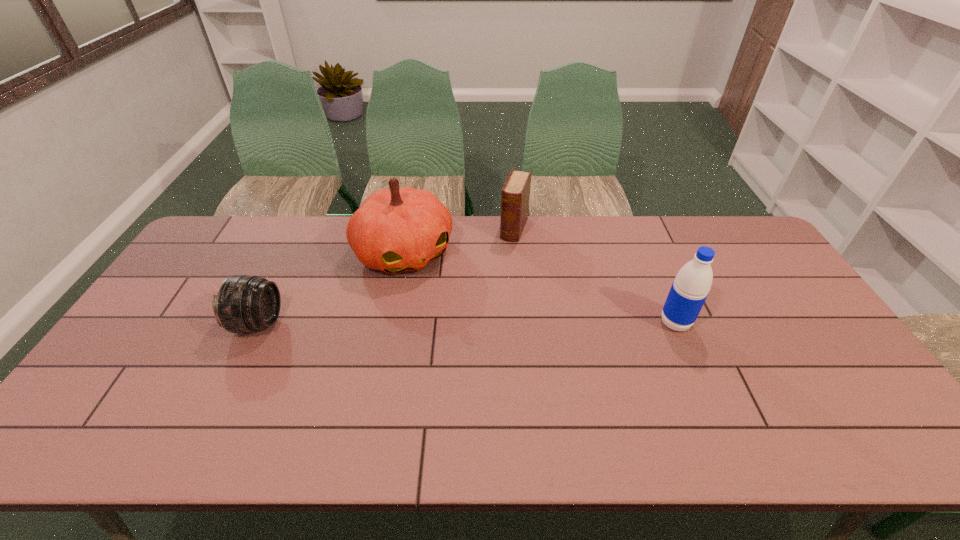
This screenshot has width=960, height=540. I want to click on free space on the desktop that is between the shortest object and the water bottle and is positioned on the spine side of the second object from right to left, so click(x=475, y=323).

This screenshot has width=960, height=540. Find the location of `free space on the desktop that is between the leftmost object and the water bottle and is positioned on the front-facing side of the pumpkin`. free space on the desktop that is between the leftmost object and the water bottle and is positioned on the front-facing side of the pumpkin is located at coordinates (456, 323).